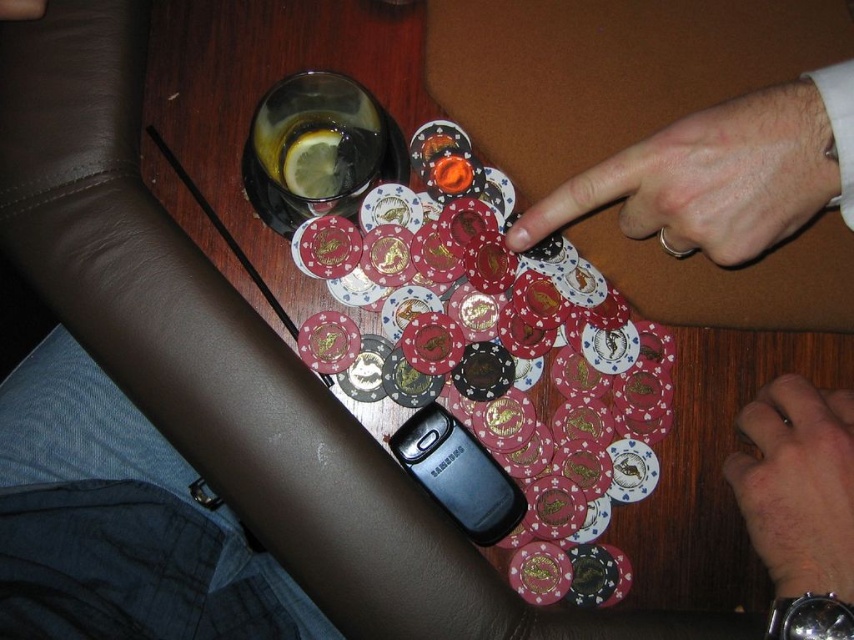
Measure the distance from smooth skin finger at upper right to smooth skin hand at lower right.

They are 5.50 inches apart.

At what (x,y) coordinates should I click in order to perform the action: click on smooth skin finger at upper right. Please return your answer as a coordinate pair (x, y). This screenshot has width=854, height=640. Looking at the image, I should click on (711, 179).

Can you confirm if metallic blue phone at center is bigger than smooth skin finger at upper right?

Indeed, metallic blue phone at center has a larger size compared to smooth skin finger at upper right.

Who is taller, metallic blue phone at center or smooth skin finger at upper right?

Standing taller between the two is metallic blue phone at center.

Is point (82, 531) more distant than point (581, 196)?

Yes, point (82, 531) is farther from viewer.

I want to click on metallic blue phone at center, so click(x=120, y=524).

Does metallic blue phone at center appear on the right side of smooth skin hand at lower right?

No, metallic blue phone at center is not to the right of smooth skin hand at lower right.

Is metallic blue phone at center further to camera compared to smooth skin hand at lower right?

No, it is in front of smooth skin hand at lower right.

Who is more distant from viewer, (156, 513) or (776, 380)?

Positioned behind is point (156, 513).

Identify the location of metallic blue phone at center. This screenshot has height=640, width=854. (120, 524).